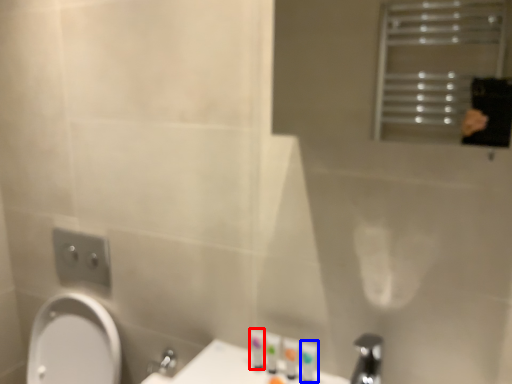
Question: Which of the following is the closest to the observer, toiletry (highlighted by a red box) or toiletry (highlighted by a blue box)?

Choices:
 (A) toiletry
 (B) toiletry

Answer: (B)